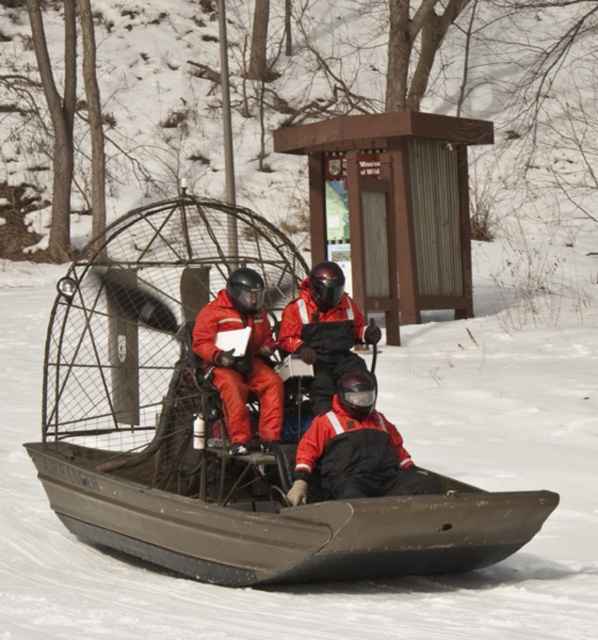
This screenshot has height=640, width=598. What do you see at coordinates (353, 449) in the screenshot?
I see `black matte jacket at center` at bounding box center [353, 449].

Is point (318, 492) positioned before point (242, 445)?

That is True.

What are the coordinates of `black matte jacket at center` in the screenshot? It's located at (353, 449).

Identify the location of black matte jacket at center. This screenshot has height=640, width=598. (353, 449).

Describe the element at coordinates (353, 449) in the screenshot. I see `black matte jacket at center` at that location.

Where is `black matte jacket at center`? The width and height of the screenshot is (598, 640). black matte jacket at center is located at coordinates (353, 449).

What do you see at coordinates (353, 449) in the screenshot? The width and height of the screenshot is (598, 640). I see `black matte jacket at center` at bounding box center [353, 449].

At what (x,y) coordinates should I click in order to perform the action: click on black matte jacket at center. Please return your answer as a coordinate pair (x, y). Looking at the image, I should click on (353, 449).

Which is more to the right, brown matte snowmobile at center or black matte jacket at center?

From the viewer's perspective, black matte jacket at center appears more on the right side.

Who is more forward, (77, 368) or (374, 451)?

Positioned in front is point (374, 451).

Find the location of a particular element. The height and width of the screenshot is (640, 598). brown matte snowmobile at center is located at coordinates (215, 428).